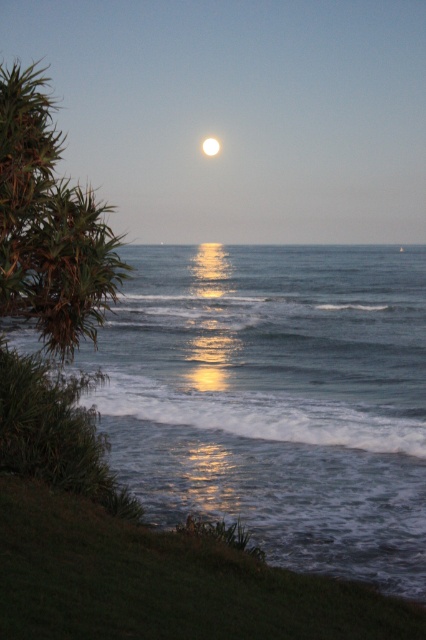
Question: Which of these objects is positioned closest to the bright white sphere at center?

Choices:
 (A) glistening blue water at lower center
 (B) smooth reflective water at center

Answer: (B)

Question: Is glistening blue water at lower center positioned before smooth reflective water at center?

Choices:
 (A) no
 (B) yes

Answer: (A)

Question: Which object is positioned closest to the glistening blue water at lower center?

Choices:
 (A) smooth reflective water at center
 (B) bright white sphere at center

Answer: (A)

Question: Does smooth reflective water at center have a greater width compared to bright white sphere at center?

Choices:
 (A) yes
 (B) no

Answer: (A)

Question: Which point is closer to the camera?

Choices:
 (A) glistening blue water at lower center
 (B) smooth reflective water at center

Answer: (B)

Question: Does smooth reflective water at center lie in front of bright white sphere at center?

Choices:
 (A) yes
 (B) no

Answer: (A)